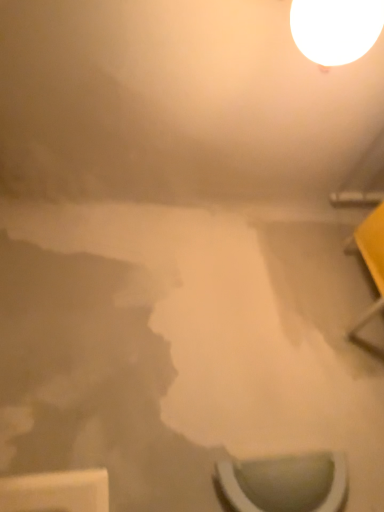
Image resolution: width=384 pixels, height=512 pixels. What do you see at coordinates (285, 483) in the screenshot? I see `matte white toilet at lower center` at bounding box center [285, 483].

Locate an element on the screen. Image resolution: width=384 pixels, height=512 pixels. matte white toilet at lower center is located at coordinates (285, 483).

Locate an element on the screen. Image resolution: width=384 pixels, height=512 pixels. matte white toilet at lower center is located at coordinates (285, 483).